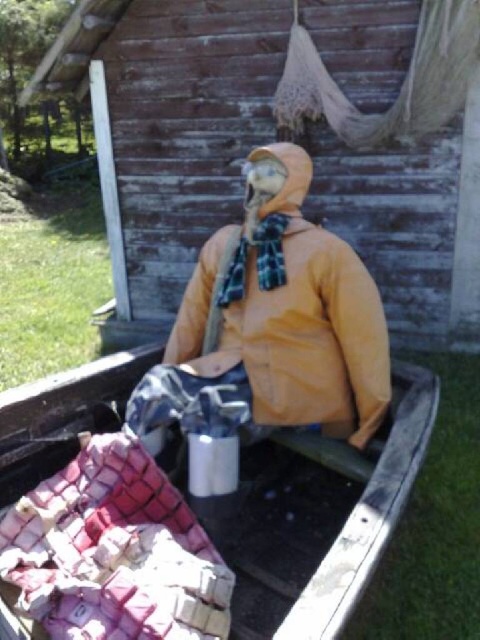
Question: Is wooden hut at center to the right of yellow matte jacket at center from the viewer's perspective?

Choices:
 (A) no
 (B) yes

Answer: (B)

Question: In this image, where is wooden hut at center located relative to wooden boat at center?

Choices:
 (A) above
 (B) below

Answer: (A)

Question: Estimate the real-world distances between objects in this image. Which object is closer to the wooden hut at center?

Choices:
 (A) yellow matte jacket at center
 (B) wooden boat at center

Answer: (A)

Question: Estimate the real-world distances between objects in this image. Which object is closer to the wooden hut at center?

Choices:
 (A) wooden boat at center
 (B) yellow matte jacket at center

Answer: (B)

Question: Which point is closer to the camera?

Choices:
 (A) yellow matte jacket at center
 (B) wooden boat at center
 (C) wooden hut at center

Answer: (B)

Question: Does wooden boat at center have a lesser width compared to yellow matte jacket at center?

Choices:
 (A) no
 (B) yes

Answer: (B)